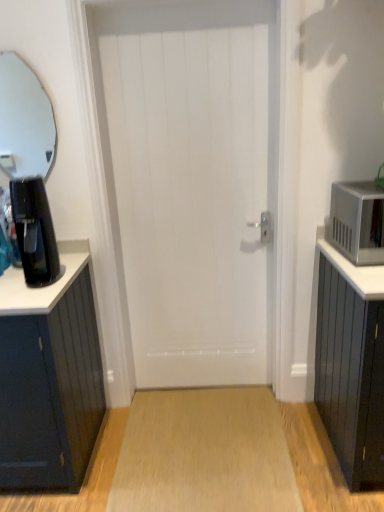
Question: Is white wooden door at center to the left of light brown wood floor at center from the viewer's perspective?

Choices:
 (A) no
 (B) yes

Answer: (B)

Question: Does white wooden door at center turn towards light brown wood floor at center?

Choices:
 (A) no
 (B) yes

Answer: (B)

Question: Can you confirm if white wooden door at center is bigger than light brown wood floor at center?

Choices:
 (A) no
 (B) yes

Answer: (B)

Question: From a real-world perspective, is white wooden door at center physically above light brown wood floor at center?

Choices:
 (A) no
 (B) yes

Answer: (B)

Question: Is white wooden door at center shorter than light brown wood floor at center?

Choices:
 (A) no
 (B) yes

Answer: (A)

Question: From the image's perspective, is clear glass mirror at upper left located above or below white wooden door at center?

Choices:
 (A) above
 (B) below

Answer: (A)

Question: In the image, is clear glass mirror at upper left positioned in front of or behind white wooden door at center?

Choices:
 (A) front
 (B) behind

Answer: (B)

Question: Based on their sizes in the image, would you say clear glass mirror at upper left is bigger or smaller than white wooden door at center?

Choices:
 (A) small
 (B) big

Answer: (A)

Question: Looking at their shapes, would you say clear glass mirror at upper left is wider or thinner than white wooden door at center?

Choices:
 (A) thin
 (B) wide

Answer: (A)

Question: In terms of height, does light brown wood floor at center look taller or shorter compared to black plastic coffee maker at left?

Choices:
 (A) short
 (B) tall

Answer: (A)

Question: From the image's perspective, is light brown wood floor at center above or below black plastic coffee maker at left?

Choices:
 (A) above
 (B) below

Answer: (B)

Question: Looking at their shapes, would you say light brown wood floor at center is wider or thinner than black plastic coffee maker at left?

Choices:
 (A) wide
 (B) thin

Answer: (A)

Question: Does point (253, 462) appear closer or farther from the camera than point (14, 220)?

Choices:
 (A) closer
 (B) farther

Answer: (B)

Question: Based on their sizes in the image, would you say light brown wood floor at center is bigger or smaller than white wooden door at center?

Choices:
 (A) big
 (B) small

Answer: (B)

Question: Considering the positions of light brown wood floor at center and white wooden door at center in the image, is light brown wood floor at center wider or thinner than white wooden door at center?

Choices:
 (A) wide
 (B) thin

Answer: (A)